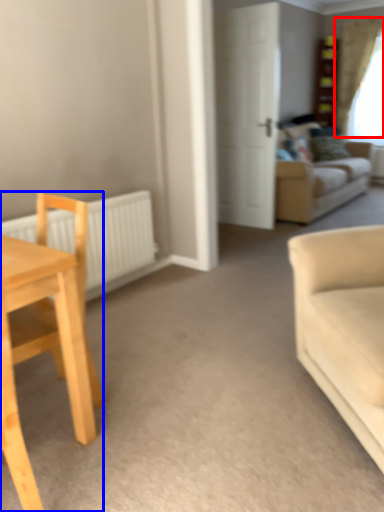
Question: Which object appears farthest to the camera in this image, curtain (highlighted by a red box) or chair (highlighted by a blue box)?

Choices:
 (A) curtain
 (B) chair

Answer: (A)